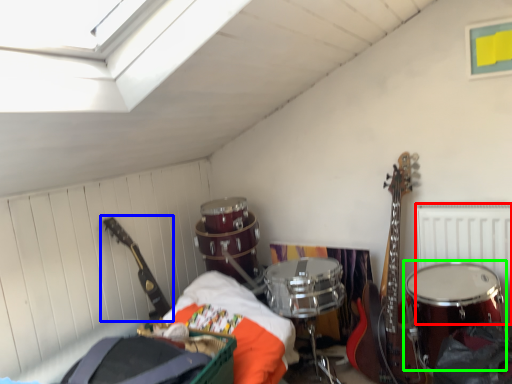
Question: Based on their relative distances, which object is farther from radiator (highlighted by a red box)? Choose from guitar (highlighted by a blue box) and drum (highlighted by a green box).

Choices:
 (A) guitar
 (B) drum

Answer: (A)